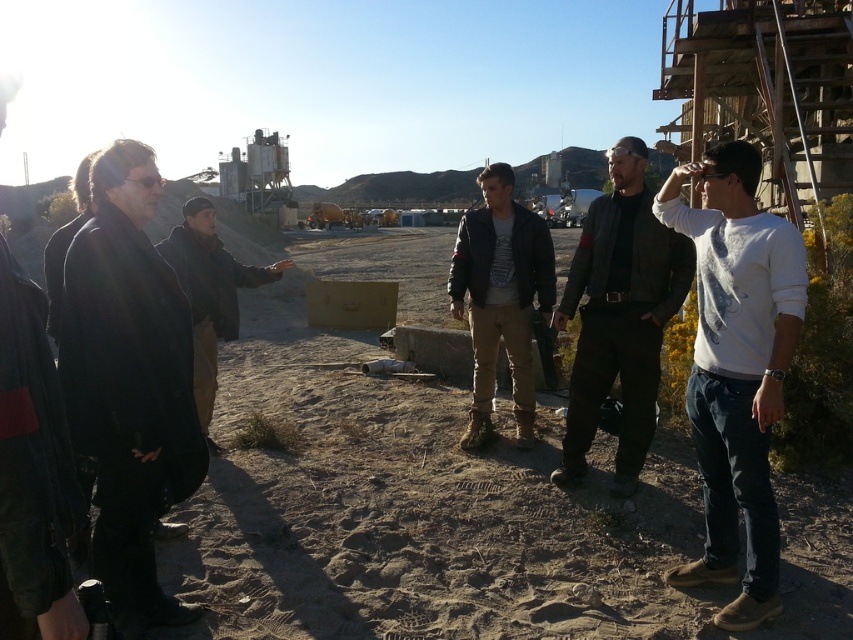
Based on the photo, which of these two, white cotton shirt at right or brown leather jacket at center, stands taller?

white cotton shirt at right is taller.

Can you confirm if white cotton shirt at right is shorter than brown leather jacket at center?

In fact, white cotton shirt at right may be taller than brown leather jacket at center.

This screenshot has height=640, width=853. Describe the element at coordinates (737, 368) in the screenshot. I see `white cotton shirt at right` at that location.

Identify the location of white cotton shirt at right. (737, 368).

Describe the element at coordinates (500, 298) in the screenshot. Image resolution: width=853 pixels, height=640 pixels. I see `dark blue leather jacket at center` at that location.

Which is in front, point (525, 436) or point (223, 282)?

Point (223, 282) is more forward.

The width and height of the screenshot is (853, 640). In order to click on dark blue leather jacket at center in this screenshot , I will do coord(500,298).

Between point (136, 170) and point (531, 244), which one is positioned behind?

Point (531, 244)

Is black matte jacket at left below dark blue leather jacket at center?

Indeed, black matte jacket at left is positioned under dark blue leather jacket at center.

Identify the location of black matte jacket at left. (128, 378).